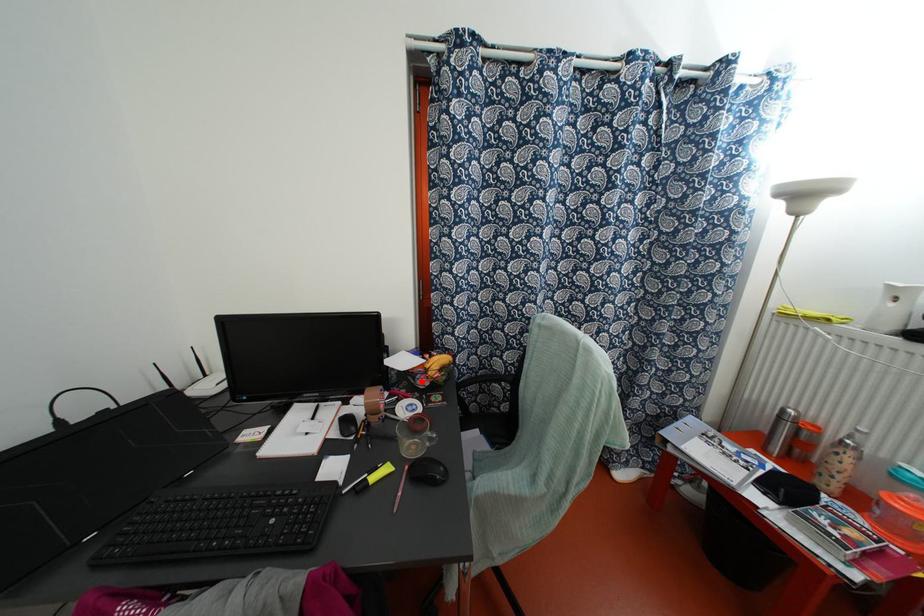
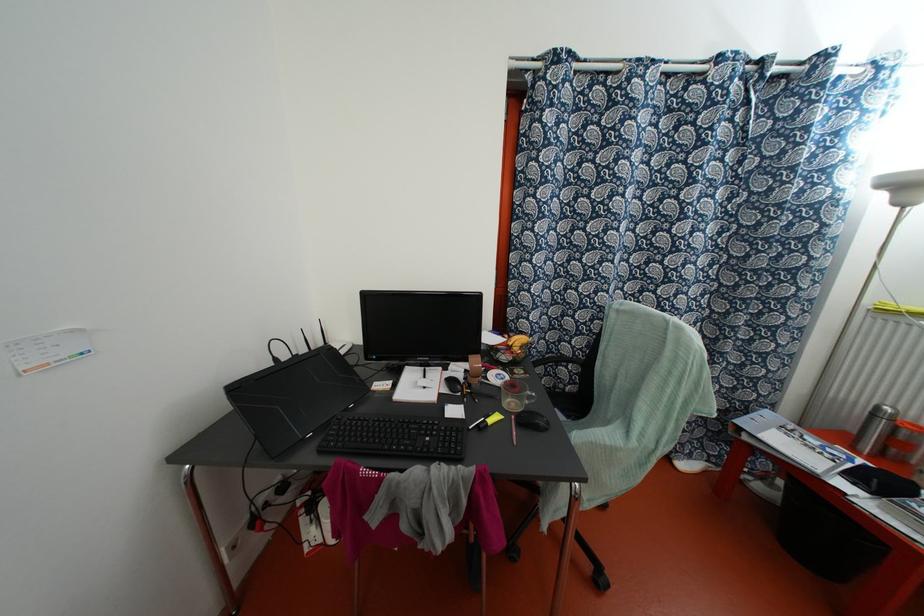
In the second image, find the point that corresponds to the highlighted location in the first image.

(504, 357)